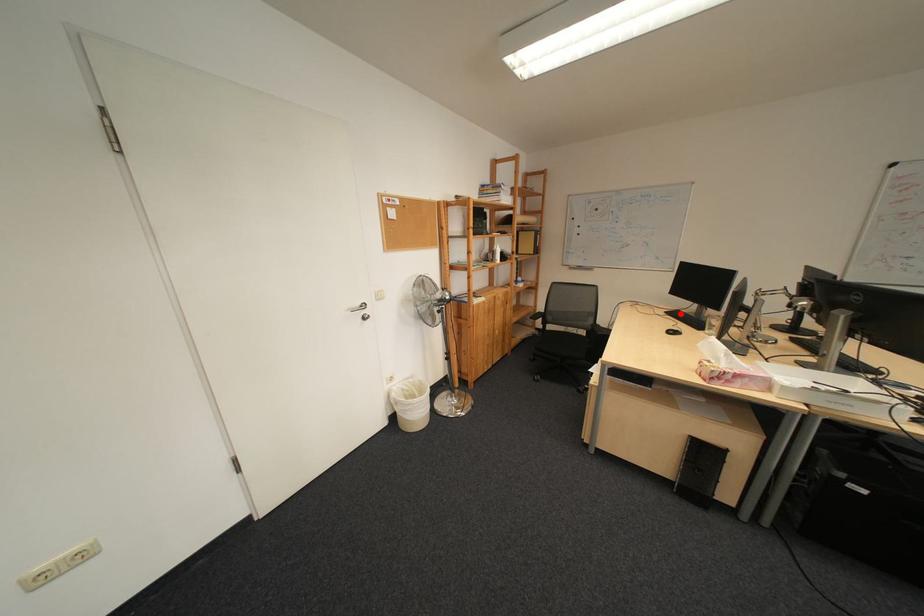
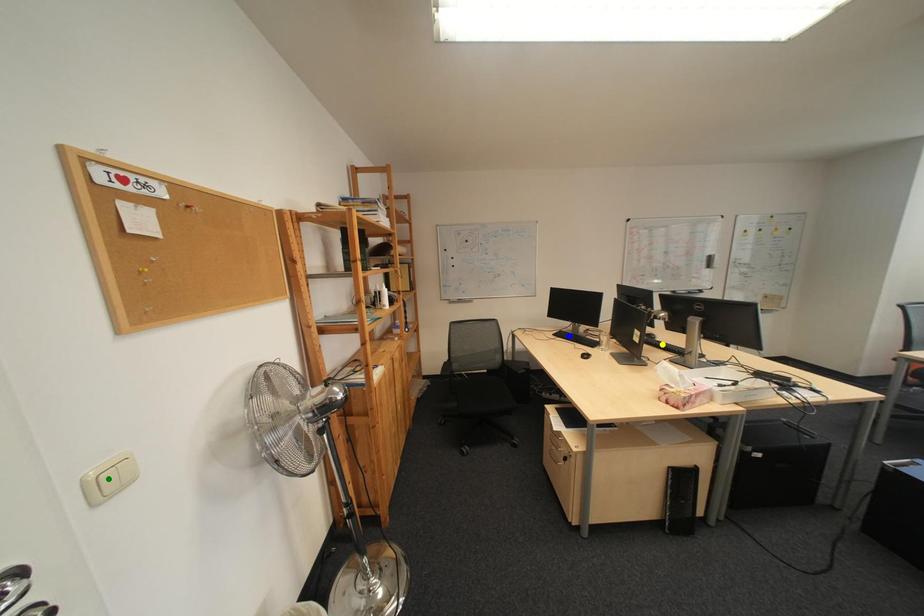
Question: I am providing you with two images of the same scene from different viewpoints. A red point is marked on the first image. You are given multiple points on the second image. Which spot in image 2 lines up with the point in image 1?

Choices:
 (A) green point
 (B) blue point
 (C) yellow point

Answer: (B)